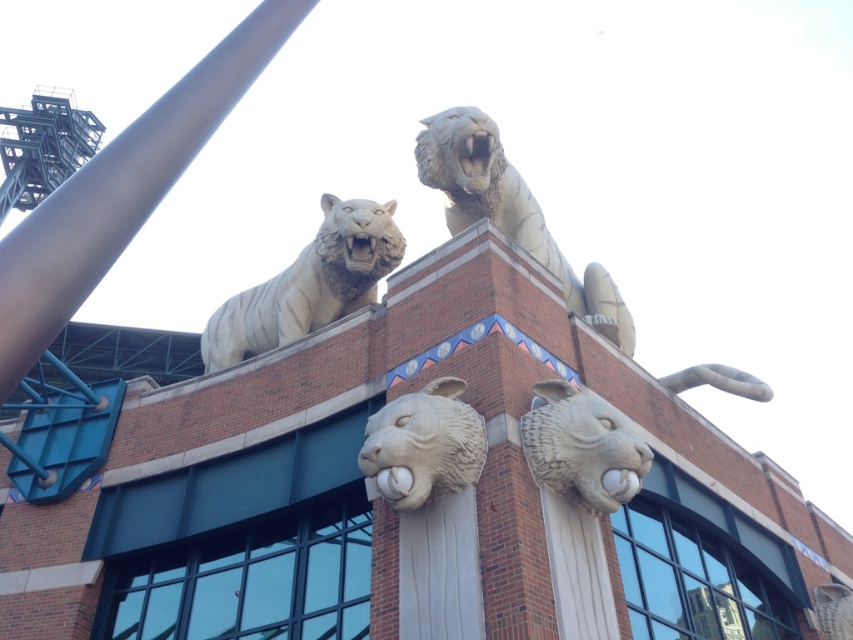
Does point (146, 112) lie in front of point (331, 211)?

Yes.

Consider the image. Between metallic gray pole at upper left and white stone tiger at upper center, which one has less height?

white stone tiger at upper center is shorter.

Identify the location of metallic gray pole at upper left. This screenshot has height=640, width=853. (122, 189).

Between point (80, 168) and point (554, 412), which one is positioned behind?

The point (80, 168) is behind.

Where is `metallic gray pole at upper left`? metallic gray pole at upper left is located at coordinates (122, 189).

Can you confirm if white stone tiger at upper center is shorter than white stone tiger head at center?

No.

The height and width of the screenshot is (640, 853). What do you see at coordinates (309, 284) in the screenshot? I see `white stone tiger at upper center` at bounding box center [309, 284].

Is point (200, 348) closer to camera compared to point (587, 397)?

No, it is behind (587, 397).

You are a GUI agent. You are given a task and a screenshot of the screen. Output one action in this format:
    pyautogui.click(x=<x>, y=<y>)
    Task: Click on the white stone tiger at upper center
    The width and height of the screenshot is (853, 640).
    Given the screenshot: What is the action you would take?
    pyautogui.click(x=309, y=284)